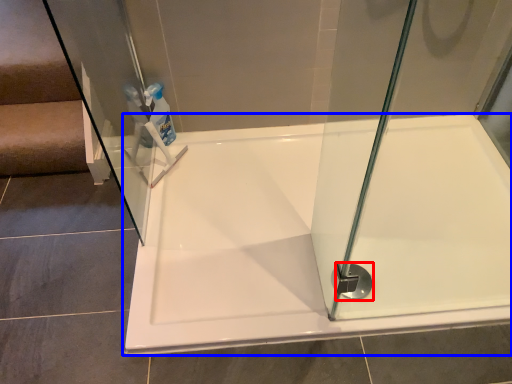
Question: Which object is closer to the camera taking this photo, shower (highlighted by a red box) or bathtub (highlighted by a blue box)?

Choices:
 (A) shower
 (B) bathtub

Answer: (B)